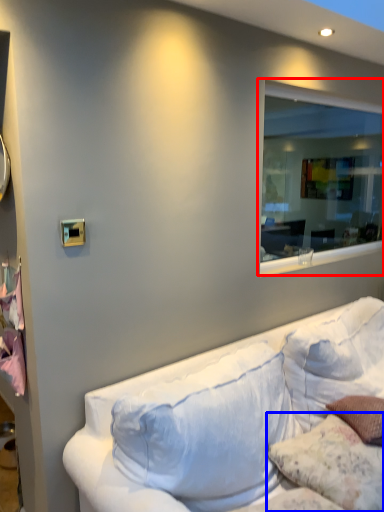
Question: Among these objects, which one is nearest to the camera, window (highlighted by a red box) or pillow (highlighted by a blue box)?

Choices:
 (A) window
 (B) pillow

Answer: (B)